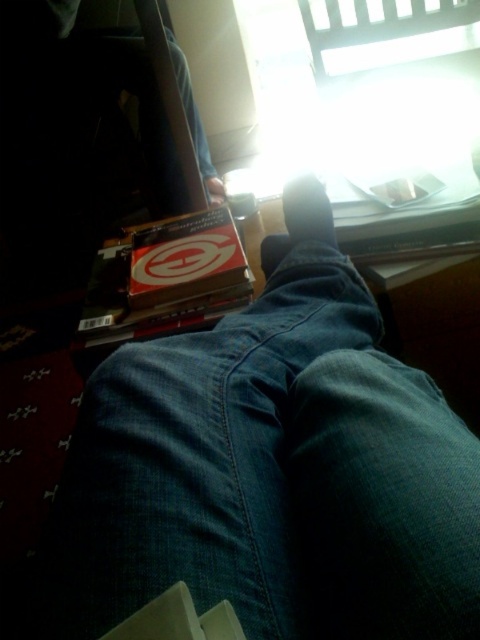
Which is below, dark blue denim jeans at center or matte black shoe at center?

dark blue denim jeans at center is below.

Is dark blue denim jeans at center wider than matte black shoe at center?

Correct, the width of dark blue denim jeans at center exceeds that of matte black shoe at center.

Where is `dark blue denim jeans at center`? This screenshot has width=480, height=640. dark blue denim jeans at center is located at coordinates (272, 474).

The image size is (480, 640). What are the coordinates of `dark blue denim jeans at center` in the screenshot? It's located at (272, 474).

Is point (304, 179) positioned after point (216, 186)?

No, it is in front of (216, 186).

Can you confirm if matte black shoe at center is positioned below matte black foot at lower center?

Answer: Correct, matte black shoe at center is located below matte black foot at lower center.

Does point (309, 173) come behind point (210, 193)?

No, it is not.

Identify the location of matte black shoe at center. The height and width of the screenshot is (640, 480). (308, 211).

Can you confirm if dark blue denim jeans at center is wider than matte black foot at lower center?

Yes.

This screenshot has width=480, height=640. I want to click on dark blue denim jeans at center, so click(x=272, y=474).

Is point (265, 296) positioned before point (210, 193)?

Yes, it is in front of point (210, 193).

Where is `dark blue denim jeans at center`? dark blue denim jeans at center is located at coordinates (272, 474).